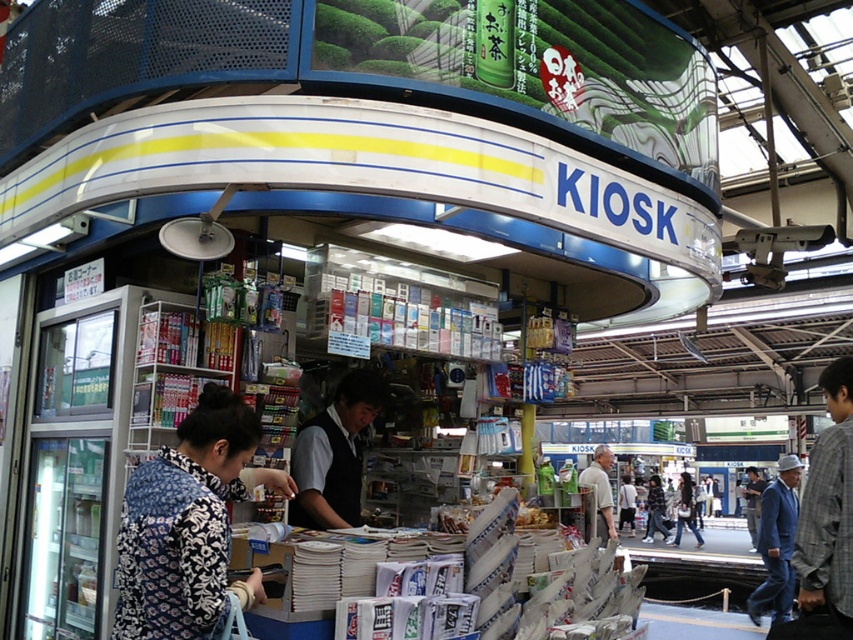
Measure the distance between gray plaid shirt at right and dark gray vest at center.

The distance of gray plaid shirt at right from dark gray vest at center is 2.37 meters.

Is point (821, 547) farther from camera compared to point (337, 465)?

No, (821, 547) is closer to viewer.

Locate an element on the screen. This screenshot has height=640, width=853. gray plaid shirt at right is located at coordinates (828, 506).

Consider the image. Can you confirm if printed fabric blouse at center is positioned to the right of light gray shirt at center?

In fact, printed fabric blouse at center is to the left of light gray shirt at center.

Between point (120, 621) and point (602, 449), which one is positioned in front?

Point (120, 621) is in front.

You are a GUI agent. You are given a task and a screenshot of the screen. Output one action in this format:
    pyautogui.click(x=<x>, y=<y>)
    Task: Click on the printed fabric blouse at center
    This screenshot has height=640, width=853.
    Given the screenshot: What is the action you would take?
    pyautogui.click(x=189, y=524)

Which is below, gray plaid shirt at right or plaid shirt at center?

plaid shirt at center is lower down.

Is gray plaid shirt at right below plaid shirt at center?

Incorrect, gray plaid shirt at right is not positioned below plaid shirt at center.

Is point (836, 531) closer to viewer compared to point (659, 520)?

Yes, it is.

Find the location of a particular element. The height and width of the screenshot is (640, 853). gray plaid shirt at right is located at coordinates (828, 506).